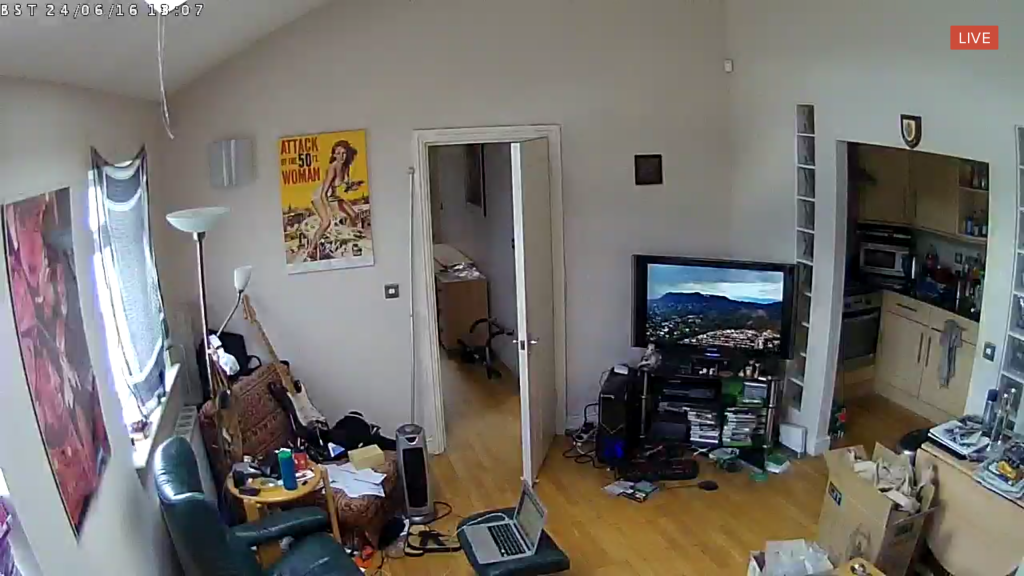
Where is `clutter`? Image resolution: width=1024 pixels, height=576 pixels. clutter is located at coordinates (336, 465), (268, 482), (723, 414), (893, 496), (1012, 463), (962, 441), (790, 556).